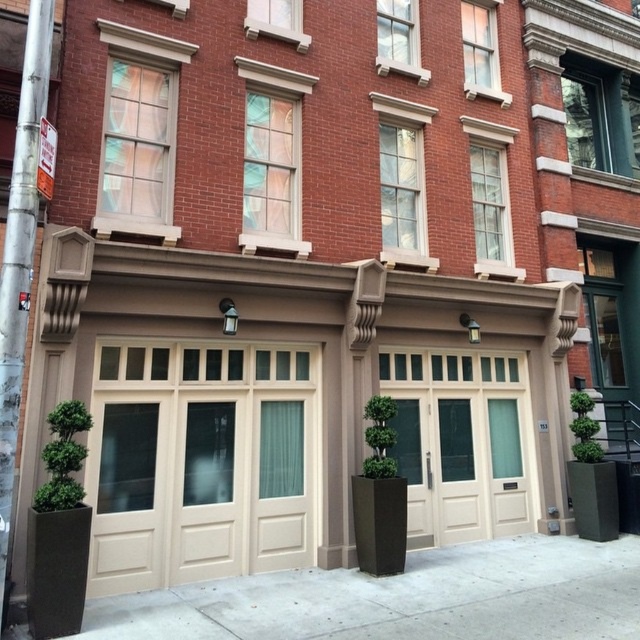
Does beige wood/glass garage door at left have a greater width compared to gray concrete pavement at lower center?

Incorrect, beige wood/glass garage door at left's width does not surpass gray concrete pavement at lower center's.

Is beige wood/glass garage door at left below gray concrete pavement at lower center?

Incorrect, beige wood/glass garage door at left is not positioned below gray concrete pavement at lower center.

Is point (196, 538) behind point (340, 580)?

No, it is in front of (340, 580).

Locate an element on the screen. beige wood/glass garage door at left is located at coordinates (198, 461).